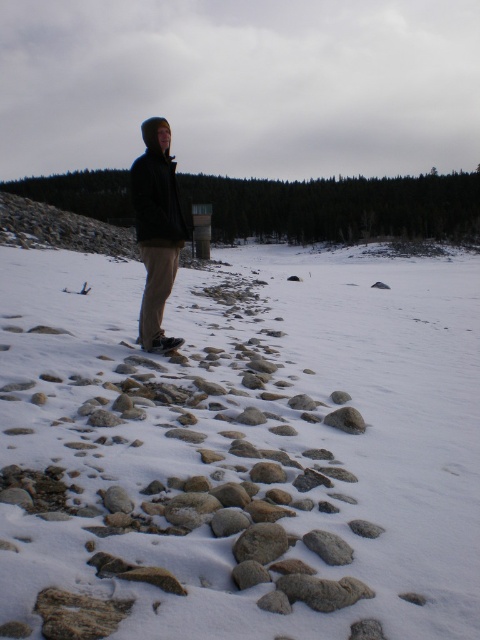
You are standing at the center of the snowy landscape and see the gray rough rock at lower center. If you move 0.1 units to the right, will you be closer to the rock?

The gray rough rock at lower center is located at point 0.855 on the x axis. Moving 0.1 units to the right would bring you to 0.955, which is further away from the rock. Therefore, you will be farther from the rock.

You are standing at the edge of the snowy landscape and want to pick up the gray rough rock at lower center and the smooth gray rock at center. Which rock should you reach for first to pick up the one closer to you?

You should reach for the gray rough rock at lower center first because it is closer to the viewer than the smooth gray rock at center.

You are an explorer trying to cross a snowy path. You see a gray rough rock at lower center and a smooth gray rock at center. Which rock is narrower in width?

The gray rough rock at lower center is thinner than the smooth gray rock at center, so it is narrower in width.